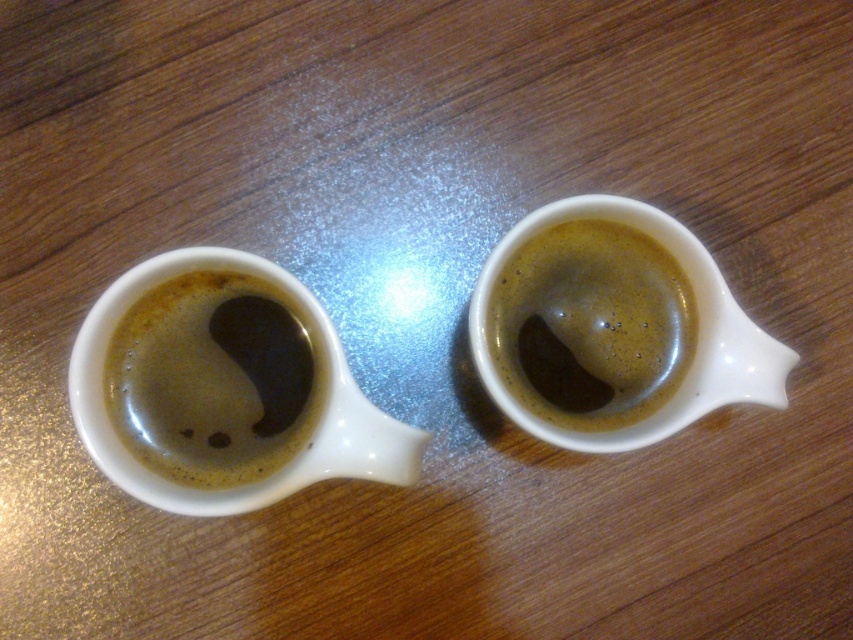
Which of these two, matte ceramic cup at left or matte ceramic cup at right, stands taller?

With more height is matte ceramic cup at left.

Is matte ceramic cup at left to the left of matte ceramic cup at right from the viewer's perspective?

Indeed, matte ceramic cup at left is positioned on the left side of matte ceramic cup at right.

Does point (138, 358) come farther from viewer compared to point (543, 342)?

No, (138, 358) is in front of (543, 342).

Find the location of a particular element. This screenshot has height=640, width=853. matte ceramic cup at left is located at coordinates (213, 380).

Can you confirm if white ceramic mug at left is smaller than matte ceramic cup at right?

Incorrect, white ceramic mug at left is not smaller in size than matte ceramic cup at right.

Is white ceramic mug at left further to camera compared to matte ceramic cup at right?

No, it is not.

Is point (82, 330) less distant than point (596, 380)?

Yes, it is in front of point (596, 380).

Find the location of a particular element. white ceramic mug at left is located at coordinates (219, 392).

Who is positioned more to the left, white ceramic mug at left or matte ceramic cup at left?

From the viewer's perspective, matte ceramic cup at left appears more on the left side.

Locate an element on the screen. white ceramic mug at left is located at coordinates (219, 392).